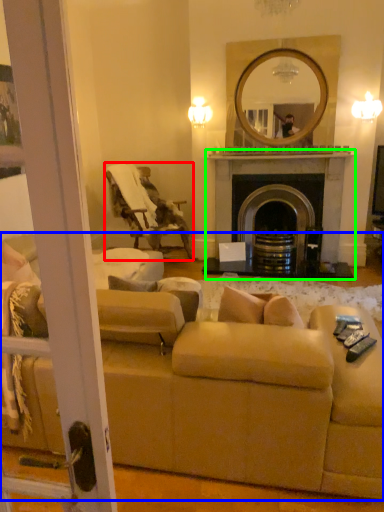
Question: Which is nearer to the chair (highlighted by a red box)? studio couch (highlighted by a blue box) or fireplace (highlighted by a green box).

Choices:
 (A) studio couch
 (B) fireplace

Answer: (B)